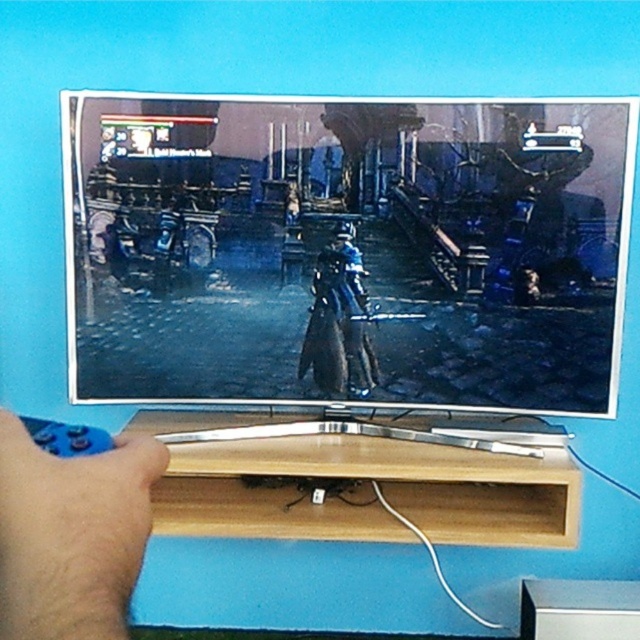
Question: Which point is closer to the camera?

Choices:
 (A) shiny metallic sword at center
 (B) blue matte remote control at lower left
 (C) shiny blue armor at center

Answer: (B)

Question: Can you confirm if shiny metallic sword at center is positioned to the left of blue matte remote control at lower left?

Choices:
 (A) no
 (B) yes

Answer: (A)

Question: Which object is closer to the camera taking this photo?

Choices:
 (A) shiny metallic sword at center
 (B) shiny blue armor at center
 (C) blue matte remote control at lower left

Answer: (C)

Question: Which of the following is the closest to the observer?

Choices:
 (A) shiny metallic sword at center
 (B) blue matte remote control at lower left
 (C) shiny blue armor at center

Answer: (B)

Question: Is blue matte remote control at lower left thinner than shiny blue armor at center?

Choices:
 (A) no
 (B) yes

Answer: (B)

Question: Can you confirm if shiny metallic sword at center is smaller than shiny blue armor at center?

Choices:
 (A) no
 (B) yes

Answer: (A)